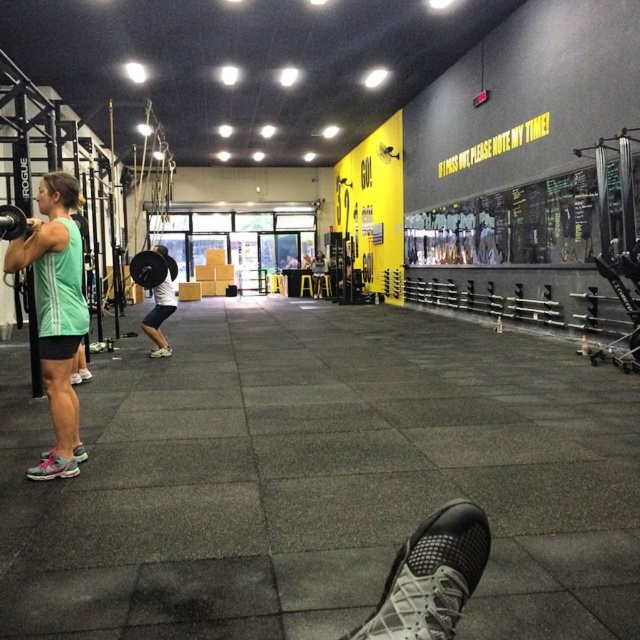
Does white mesh shoe at lower center have a smaller size compared to pink mesh shoe at lower left?

Actually, white mesh shoe at lower center might be larger than pink mesh shoe at lower left.

Can you confirm if white mesh shoe at lower center is positioned to the right of pink mesh shoe at lower left?

Indeed, white mesh shoe at lower center is positioned on the right side of pink mesh shoe at lower left.

Which is behind, point (442, 625) or point (77, 451)?

The point (77, 451) is behind.

The image size is (640, 640). I want to click on white mesh shoe at lower center, so click(x=432, y=577).

Does point (44, 468) come in front of point (161, 259)?

Yes, point (44, 468) is closer to viewer.

Which is in front, point (58, 333) or point (148, 266)?

Positioned in front is point (58, 333).

Does point (60, 433) lie behind point (134, 257)?

No, (60, 433) is closer to viewer.

This screenshot has width=640, height=640. What are the coordinates of `green matte tank top at center` in the screenshot? It's located at (54, 314).

Can you confirm if green matte tank top at center is positioned above white mesh shoe at lower center?

Yes.

Can you confirm if green matte tank top at center is wider than white mesh shoe at lower center?

Yes.

This screenshot has height=640, width=640. In order to click on green matte tank top at center in this screenshot , I will do `click(54, 314)`.